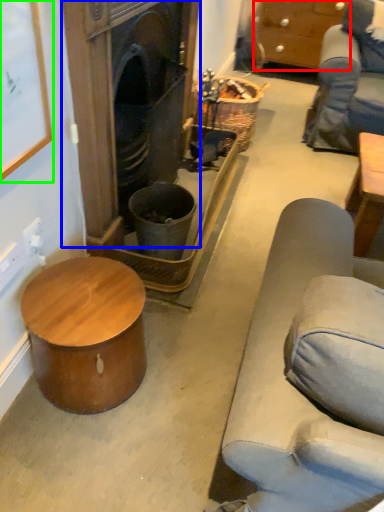
Question: Estimate the real-world distances between objects in this image. Which object is farther from cabinetry (highlighted by a red box), fireplace (highlighted by a blue box) or picture frame (highlighted by a green box)?

Choices:
 (A) fireplace
 (B) picture frame

Answer: (B)